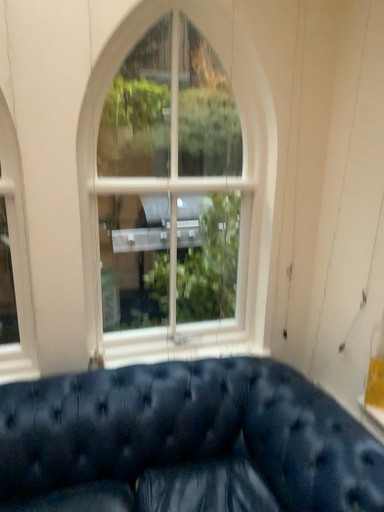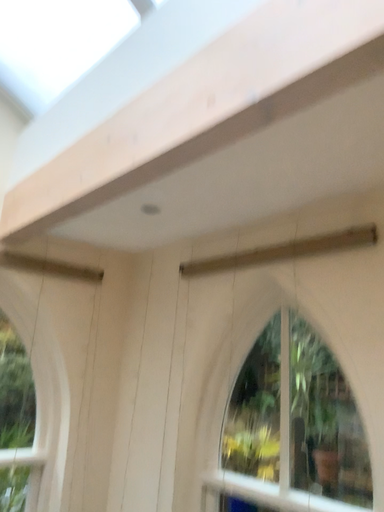
Question: Which way did the camera rotate in the video?

Choices:
 (A) rotated right
 (B) rotated left

Answer: (A)